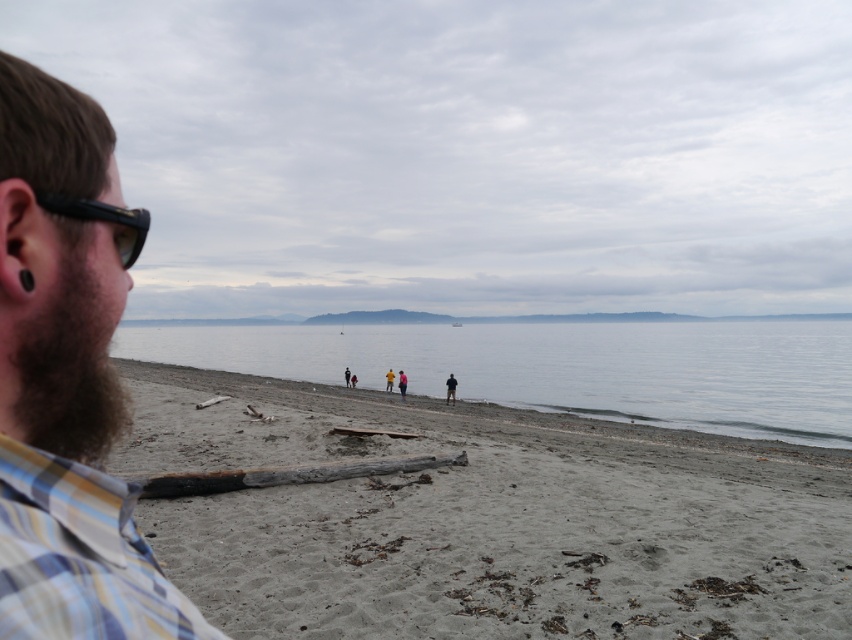
You are a photographer standing on the beach and want to capture a photo where the clear water at center and the charcoal wood log at lower center are both visible. Based on their positions and sizes, which object will appear larger in the photo?

The clear water at center will appear larger in the photo because it is much taller than the charcoal wood log at lower center.

You are standing at the beach and see two points marked in the image. The first point is located at coordinates point (813, 369) and the second point is at point (122, 266). Which point is closer to the horizon?

Point (813, 369) is behind point (122, 266), so point (122, 266) is closer to the horizon.